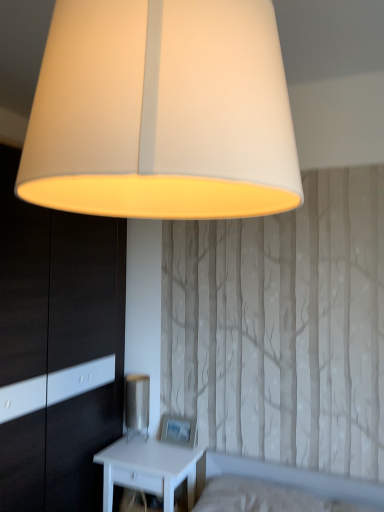
Question: Can you confirm if metallic silver table lamp at lower center is smaller than white matte nightstand at lower left?

Choices:
 (A) yes
 (B) no

Answer: (A)

Question: Considering the relative positions of metallic silver table lamp at lower center and white matte nightstand at lower left in the image provided, is metallic silver table lamp at lower center behind white matte nightstand at lower left?

Choices:
 (A) yes
 (B) no

Answer: (A)

Question: Is metallic silver table lamp at lower center touching white matte nightstand at lower left?

Choices:
 (A) no
 (B) yes

Answer: (A)

Question: Considering the relative positions of metallic silver table lamp at lower center and white matte nightstand at lower left in the image provided, is metallic silver table lamp at lower center in front of white matte nightstand at lower left?

Choices:
 (A) no
 (B) yes

Answer: (A)

Question: Is metallic silver table lamp at lower center to the right of white matte nightstand at lower left from the viewer's perspective?

Choices:
 (A) yes
 (B) no

Answer: (B)

Question: Considering the relative positions of metallic silver table lamp at lower center and matte white lampshade at upper center in the image provided, is metallic silver table lamp at lower center to the left or to the right of matte white lampshade at upper center?

Choices:
 (A) left
 (B) right

Answer: (A)

Question: Considering the positions of metallic silver table lamp at lower center and matte white lampshade at upper center in the image, is metallic silver table lamp at lower center wider or thinner than matte white lampshade at upper center?

Choices:
 (A) thin
 (B) wide

Answer: (A)

Question: Relative to matte white lampshade at upper center, is metallic silver table lamp at lower center in front or behind?

Choices:
 (A) behind
 (B) front

Answer: (A)

Question: From the image's perspective, is metallic silver table lamp at lower center positioned above or below matte white lampshade at upper center?

Choices:
 (A) above
 (B) below

Answer: (B)

Question: Is metallic silver table lamp at lower center taller or shorter than white glossy dresser at left?

Choices:
 (A) short
 (B) tall

Answer: (A)

Question: Is point (132, 397) closer or farther from the camera than point (99, 488)?

Choices:
 (A) farther
 (B) closer

Answer: (A)

Question: In the image, is metallic silver table lamp at lower center on the left side or the right side of white glossy dresser at left?

Choices:
 (A) left
 (B) right

Answer: (B)

Question: From the image's perspective, relative to white glossy dresser at left, is metallic silver table lamp at lower center above or below?

Choices:
 (A) below
 (B) above

Answer: (A)

Question: From the image's perspective, is white matte nightstand at lower left positioned above or below metallic silver table lamp at lower center?

Choices:
 (A) above
 (B) below

Answer: (B)

Question: Based on their sizes in the image, would you say white matte nightstand at lower left is bigger or smaller than metallic silver table lamp at lower center?

Choices:
 (A) big
 (B) small

Answer: (A)